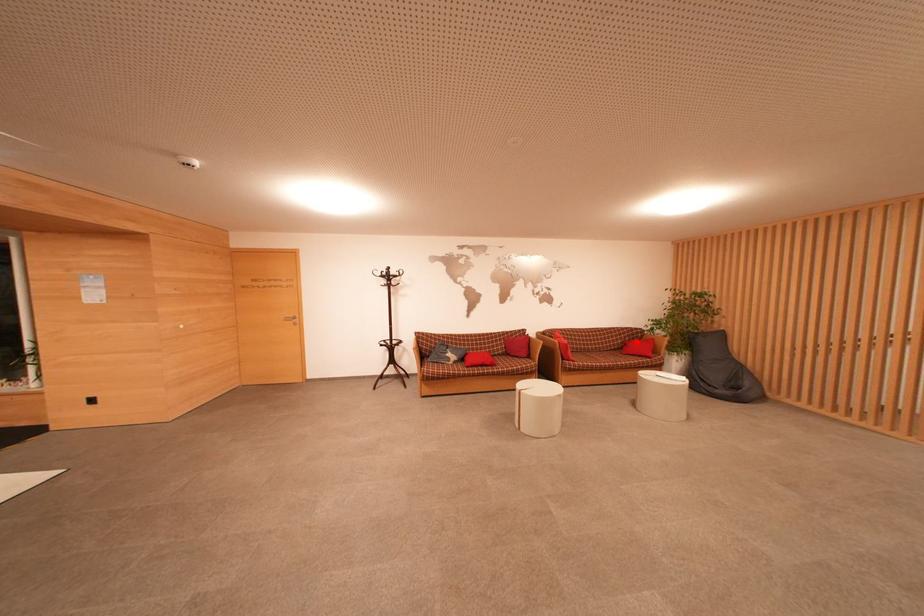
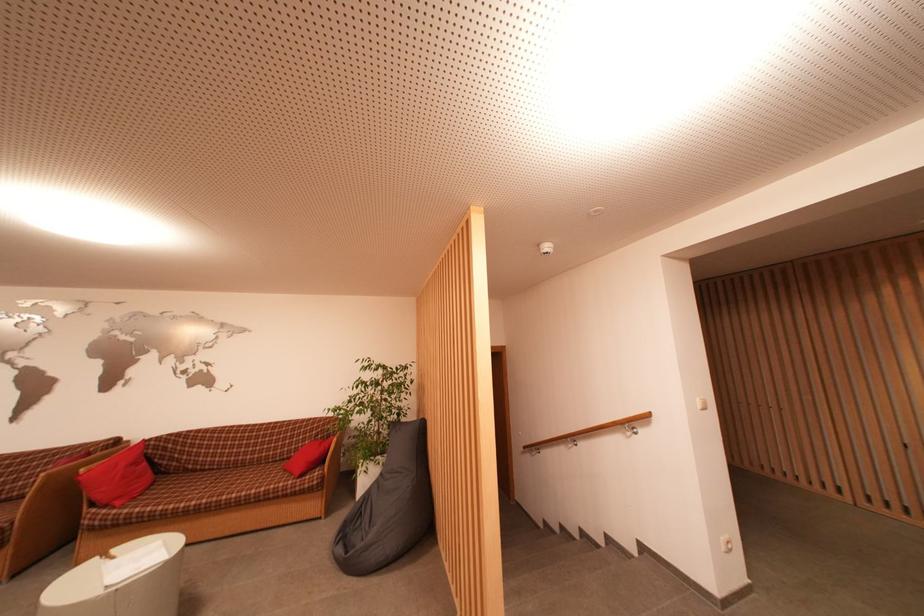
Question: I am providing you with two images of the same scene from different viewpoints. Given a red point in image1, look at the same physical point in image2. Is it:

Choices:
 (A) Closer to the viewpoint
 (B) Farther from the viewpoint

Answer: (B)